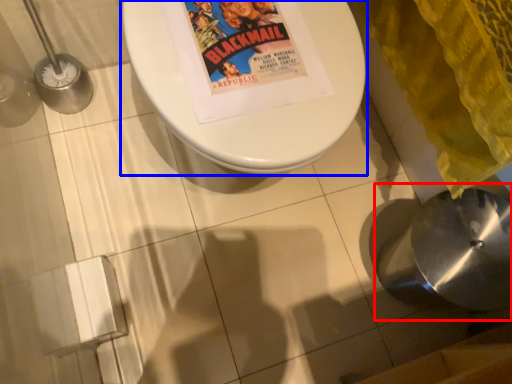
Question: Among these objects, which one is nearest to the camera, sink (highlighted by a red box) or toilet (highlighted by a blue box)?

Choices:
 (A) sink
 (B) toilet

Answer: (B)